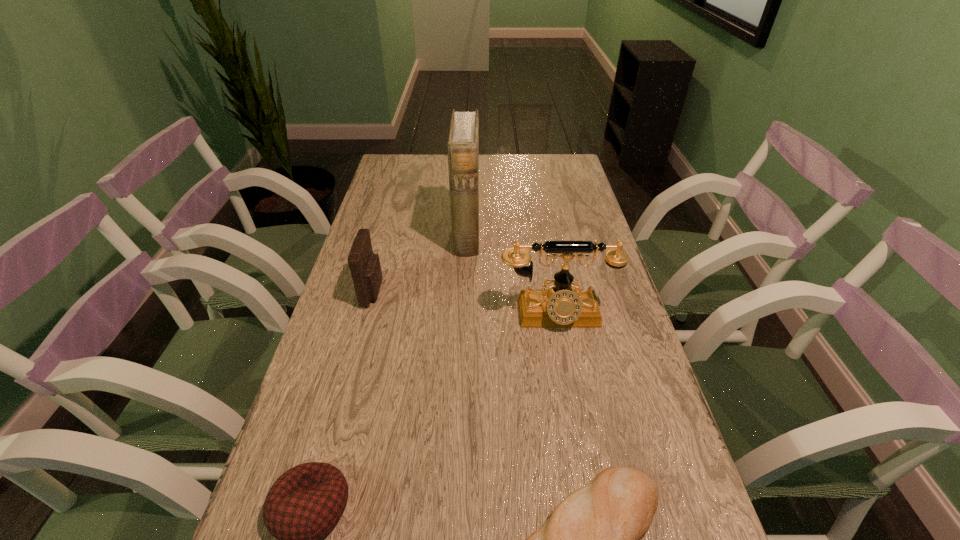
Find the location of a particular element. Image resolution: width=960 pixels, height=540 pixels. vacant region at the left edge is located at coordinates (391, 204).

You are a GUI agent. You are given a task and a screenshot of the screen. Output one action in this format:
    pyautogui.click(x=<x>, y=<y>)
    Task: Click on the free space at the right edge
    
    Given the screenshot: What is the action you would take?
    pyautogui.click(x=594, y=342)

Identify the location of vacant space at the far left corner. The height and width of the screenshot is (540, 960). (402, 157).

The height and width of the screenshot is (540, 960). In order to click on vacant space at the far right corner in this screenshot , I will do `click(564, 169)`.

At what (x,y) coordinates should I click in order to perform the action: click on empty space that is in between the farthest object and the third tallest object. Please return your answer as a coordinate pair (x, y). Looking at the image, I should click on (420, 263).

What are the coordinates of `free space between the second tallest object and the third shortest object` in the screenshot? It's located at (465, 303).

Identify the location of free spot between the third object from right to left and the pouch. (420, 263).

I want to click on free space between the third tallest object and the fourth shortest object, so click(x=465, y=303).

Where is `the second closest object to the telephone`? This screenshot has height=540, width=960. the second closest object to the telephone is located at coordinates point(365,268).

Identify the location of object that is the fourth closest to the fourth shortest object. (305, 503).